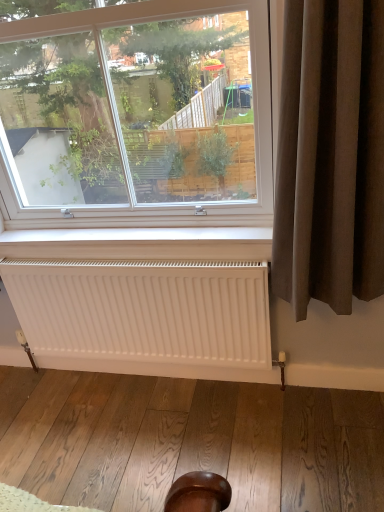
Question: Considering the positions of white matte radiator at lower center and brown fabric curtain at right in the image, is white matte radiator at lower center wider or thinner than brown fabric curtain at right?

Choices:
 (A) wide
 (B) thin

Answer: (B)

Question: In terms of size, does white matte radiator at lower center appear bigger or smaller than brown fabric curtain at right?

Choices:
 (A) big
 (B) small

Answer: (B)

Question: Based on their relative distances, which object is farther from the clear glass window at upper center?

Choices:
 (A) brown fabric curtain at right
 (B) white matte radiator at lower center

Answer: (B)

Question: Based on their relative distances, which object is nearer to the white matte radiator at lower center?

Choices:
 (A) clear glass window at upper center
 (B) brown fabric curtain at right

Answer: (A)